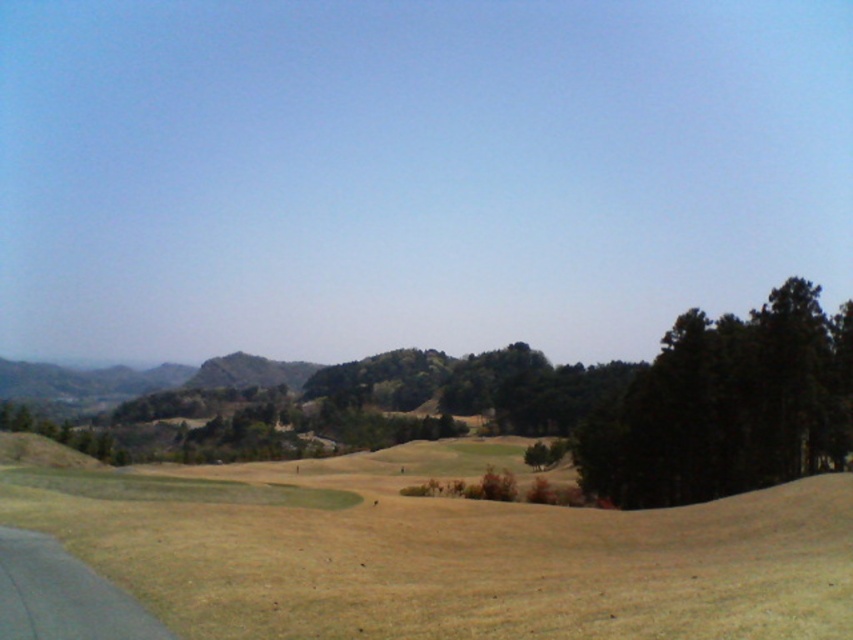
Question: Which point is closer to the camera?

Choices:
 (A) (730, 317)
 (B) (372, 490)

Answer: (B)

Question: Is green grassy field at center below dark green textured trees at right?

Choices:
 (A) no
 (B) yes

Answer: (B)

Question: Is green grassy field at center positioned behind dark green textured trees at right?

Choices:
 (A) yes
 (B) no

Answer: (B)

Question: Which object appears farthest from the camera in this image?

Choices:
 (A) dark green textured trees at right
 (B) green grassy field at center

Answer: (A)

Question: Is green grassy field at center behind dark green textured trees at right?

Choices:
 (A) yes
 (B) no

Answer: (B)